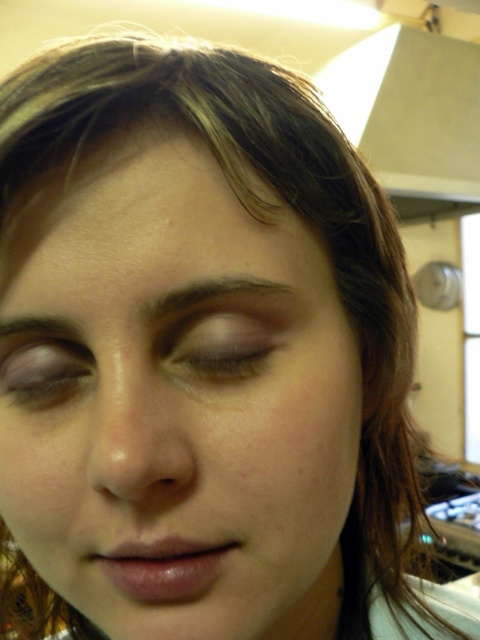
What do you see at coordinates (180, 404) in the screenshot? This screenshot has height=640, width=480. I see `smooth skin face at center` at bounding box center [180, 404].

I want to click on smooth skin face at center, so click(x=180, y=404).

Which is below, matte skin nose at center or matte brown eye at center?

Positioned lower is matte skin nose at center.

What do you see at coordinates (137, 436) in the screenshot? This screenshot has height=640, width=480. I see `matte skin nose at center` at bounding box center [137, 436].

Identify the location of matte skin nose at center. The image size is (480, 640). (137, 436).

Can you confirm if matte brown eye at lower left is smaller than dark brown hair at upper center?

No.

Does point (58, 403) come farther from viewer compared to point (172, 296)?

Yes, point (58, 403) is behind point (172, 296).

The width and height of the screenshot is (480, 640). In order to click on matte brown eye at lower left in this screenshot , I will do `click(45, 372)`.